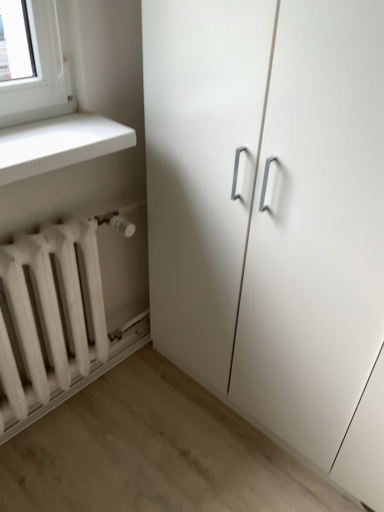
You are a GUI agent. You are given a task and a screenshot of the screen. Output one action in this format:
    pyautogui.click(x=<x>, y=<y>)
    Task: Click on the vacant space underneath white matte radiator at lower left (from a real-world perspective)
    The height and width of the screenshot is (512, 384).
    Given the screenshot: What is the action you would take?
    pyautogui.click(x=67, y=413)